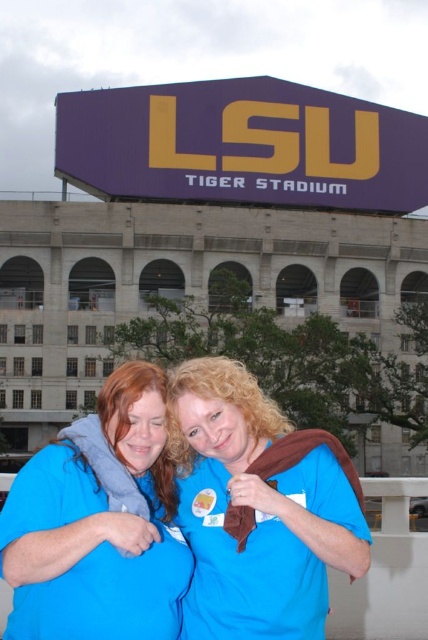
Is blue fabric at center below blue fabric shirt at center?

No.

Does blue fabric at center have a greater height compared to blue fabric shirt at center?

Yes.

Describe the element at coordinates (258, 508) in the screenshot. The image size is (428, 640). I see `blue fabric at center` at that location.

The image size is (428, 640). Identify the location of blue fabric at center. coord(258,508).